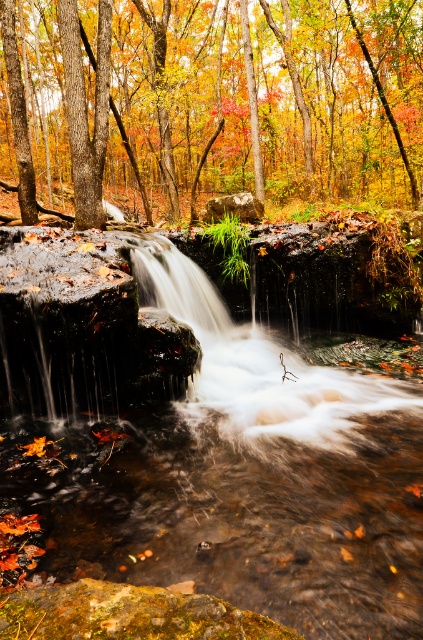
Which of these two, autumn leaves at center or smooth stone waterfall at center, stands taller?

autumn leaves at center

Measure the distance between autumn leaves at center and camera.

autumn leaves at center and camera are 9.64 meters apart from each other.

Does point (216, 118) come closer to viewer compared to point (313, 403)?

No, (216, 118) is further to viewer.

Image resolution: width=423 pixels, height=640 pixels. In order to click on autumn leaves at center in this screenshot , I will do `click(211, 100)`.

What do you see at coordinates (214, 454) in the screenshot?
I see `translucent water at center` at bounding box center [214, 454].

Does translucent water at center lie in front of autumn leaves at center?

That is True.

Which is behind, point (192, 516) or point (30, 93)?

The point (30, 93) is behind.

You are a GUI agent. You are given a task and a screenshot of the screen. Output one action in this format:
    pyautogui.click(x=<x>, y=<y>)
    Task: Click on the translucent water at center
    
    Given the screenshot: What is the action you would take?
    click(214, 454)

How far apart are translucent water at center and smooth stone waterfall at center?

translucent water at center is 50.73 centimeters from smooth stone waterfall at center.

Is point (293, 544) closer to camera compared to point (220, 310)?

Yes, point (293, 544) is closer to viewer.

What do you see at coordinates (214, 454) in the screenshot? Image resolution: width=423 pixels, height=640 pixels. I see `translucent water at center` at bounding box center [214, 454].

Find the location of a particular element. translucent water at center is located at coordinates (214, 454).